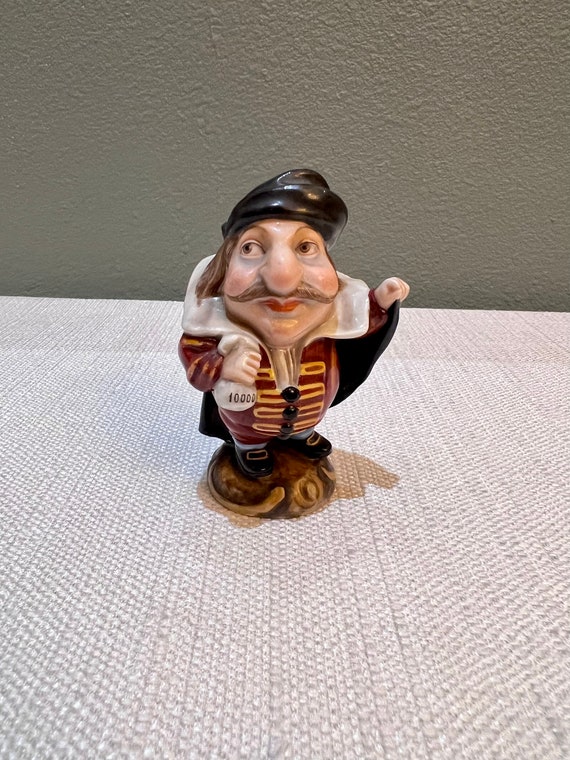
You are a GUI agent. You are given a task and a screenshot of the screen. Output one action in this format:
    pyautogui.click(x=<x>, y=<y>)
    Task: Click on the surface
    
    Given the screenshot: What is the action you would take?
    pyautogui.click(x=259, y=575)